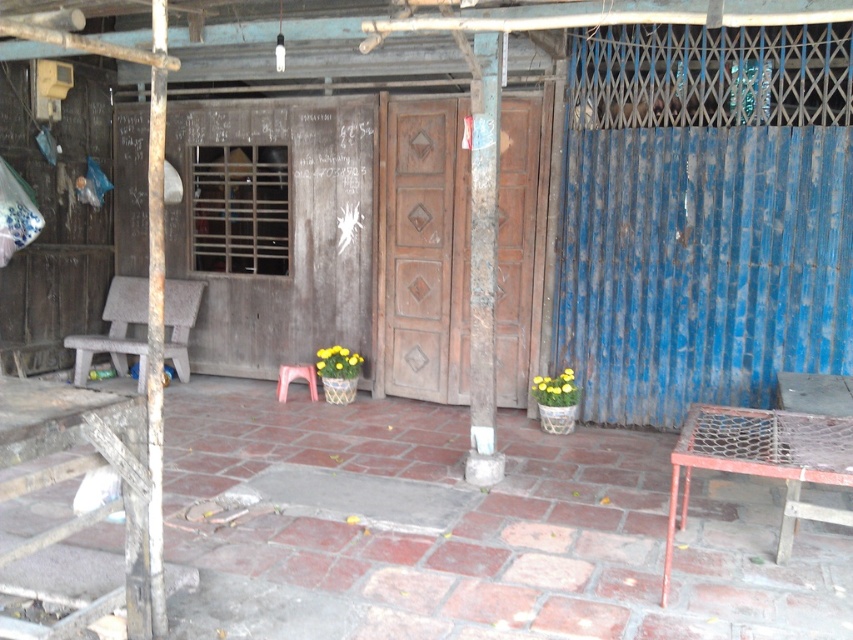
Question: Does wooden door at center have a greater width compared to plastic stool at lower center?

Choices:
 (A) no
 (B) yes

Answer: (B)

Question: Is wooden door at center to the right of plastic stool at lower center from the viewer's perspective?

Choices:
 (A) yes
 (B) no

Answer: (A)

Question: Which point is farther to the camera?

Choices:
 (A) (422, 298)
 (B) (288, 381)

Answer: (B)

Question: Which of the following is the closest to the observer?

Choices:
 (A) plastic stool at lower center
 (B) wooden door at center

Answer: (B)

Question: Does wooden door at center appear under plastic stool at lower center?

Choices:
 (A) yes
 (B) no

Answer: (B)

Question: Which of the following is the closest to the observer?

Choices:
 (A) (312, 396)
 (B) (456, 168)

Answer: (B)